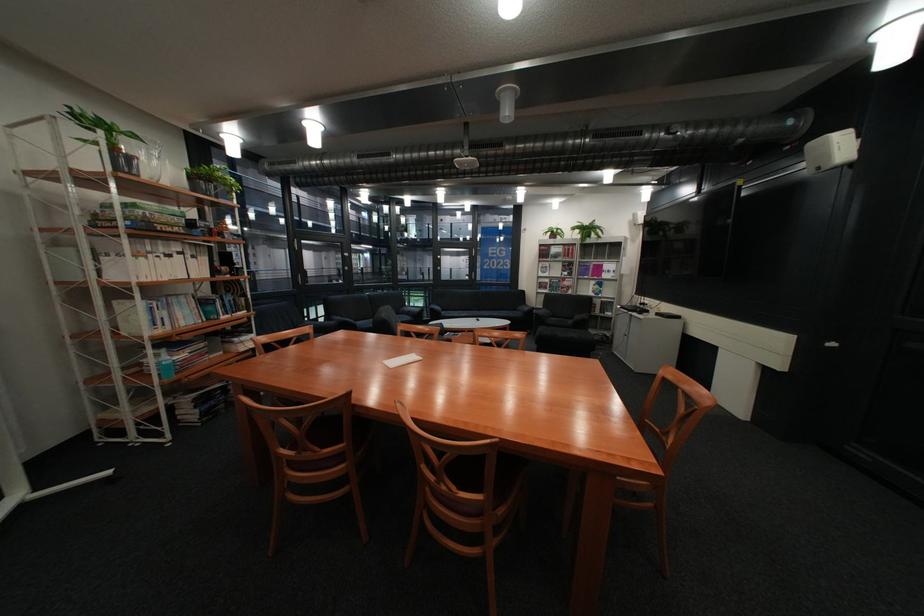
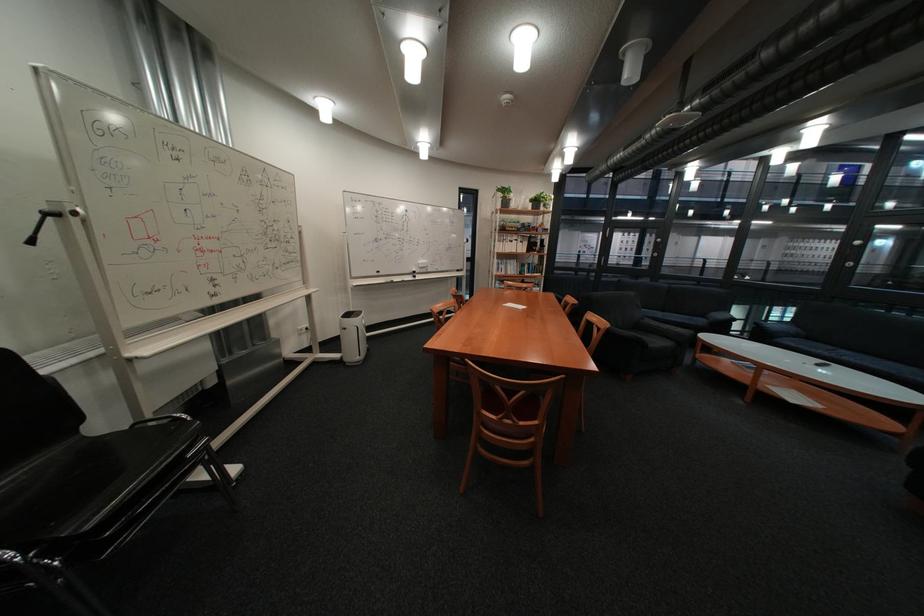
Locate, in the second image, the point that corresponds to point 466,315 in the first image.

(808, 345)